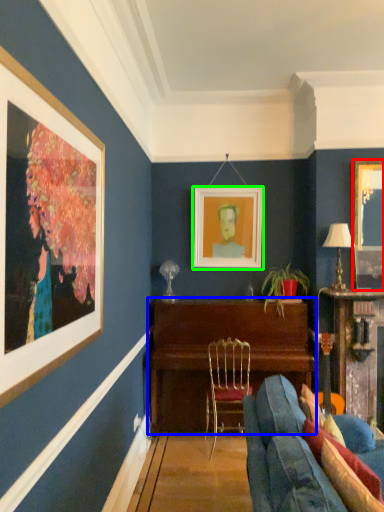
Question: Based on their relative distances, which object is nearer to picture frame (highlighted by a red box)? Choose from table (highlighted by a blue box) and picture frame (highlighted by a green box).

Choices:
 (A) table
 (B) picture frame

Answer: (B)